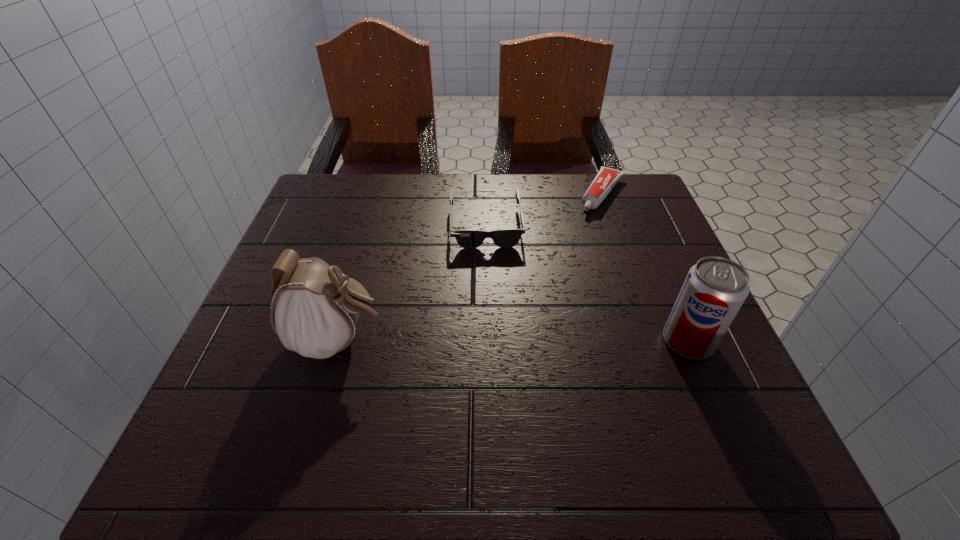
At what (x,y) coordinates should I click in order to perform the action: click on free space between the toothpaste and the leftmost object. Please return your answer as a coordinate pair (x, y). Looking at the image, I should click on (470, 267).

Image resolution: width=960 pixels, height=540 pixels. Identify the location of free space that is in between the second tallest object and the pouch. (514, 341).

At what (x,y) coordinates should I click in order to perform the action: click on free space between the third tallest object and the leftmost object. Please return your answer as a coordinate pair (x, y). Looking at the image, I should click on (412, 283).

I want to click on vacant space that's between the third object from right to left and the toothpaste, so click(544, 209).

Find the location of a particular element. Image resolution: width=960 pixels, height=540 pixels. unoccupied area between the third tallest object and the leftmost object is located at coordinates (412, 283).

The image size is (960, 540). I want to click on empty location between the leftmost object and the soda, so click(x=514, y=341).

This screenshot has width=960, height=540. What are the coordinates of `object that stands as the third closest to the shortest object` in the screenshot? It's located at (314, 312).

Locate which object ranks in proximity to the toothpaste. Please provide its 2D coordinates. Your answer should be formatted as a tuple, i.e. [(x, y)], where the tuple contains the x and y coordinates of a point satisfying the conditions above.

[(467, 238)]

I want to click on blank area in the image that satisfies the following two spatial constraints: 1. on the back side of the second shortest object; 2. on the left side of the shortest object, so click(x=485, y=193).